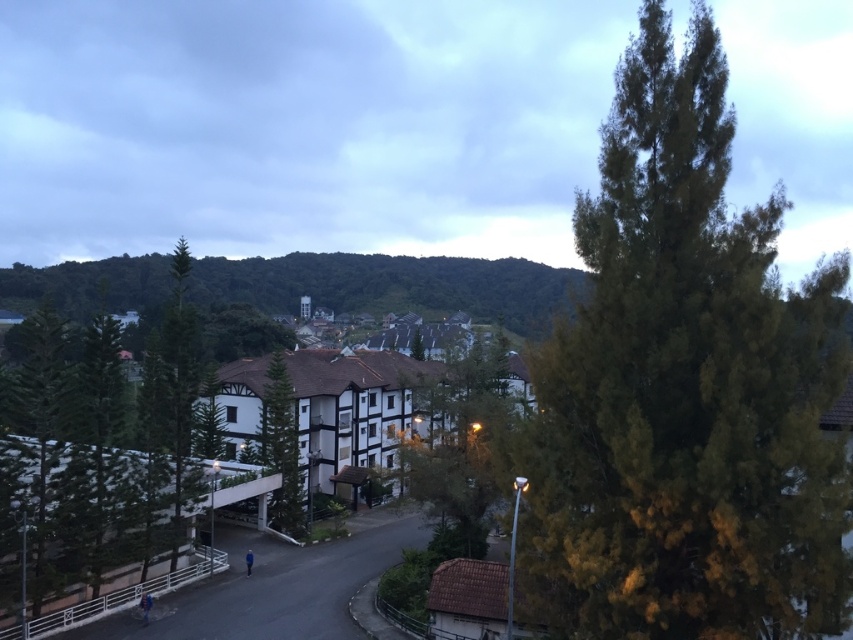
Can you confirm if green leafy hill at center is positioned to the right of green textured tree at center?

Correct, you'll find green leafy hill at center to the right of green textured tree at center.

Is green leafy hill at center below green textured tree at center?

Incorrect, green leafy hill at center is not positioned below green textured tree at center.

Between point (497, 272) and point (277, 413), which one is positioned in front?

Positioned in front is point (277, 413).

The height and width of the screenshot is (640, 853). I want to click on green leafy hill at center, so click(x=393, y=285).

Can you confirm if green leafy tree at upper right is positioned above green leafy tree at center?

Correct, green leafy tree at upper right is located above green leafy tree at center.

Is point (84, 81) closer to viewer compared to point (498, 358)?

No, it is not.

Which is in front, point (459, 148) or point (486, 492)?

Point (486, 492)

Image resolution: width=853 pixels, height=640 pixels. Find the location of `green leafy tree at upper right`. green leafy tree at upper right is located at coordinates (300, 125).

Does point (672, 390) lie behind point (410, 490)?

No, it is not.

Can you confirm if green leafy tree at right is positioned to the left of green leafy tree at center?

No, green leafy tree at right is not to the left of green leafy tree at center.

The image size is (853, 640). Identify the location of green leafy tree at right. (685, 388).